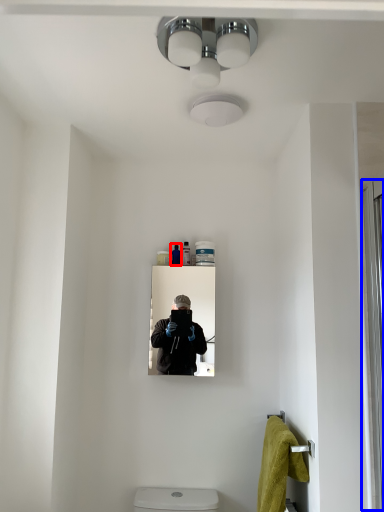
Question: Which object is further to the camera taking this photo, toiletry (highlighted by a red box) or screen door (highlighted by a blue box)?

Choices:
 (A) toiletry
 (B) screen door

Answer: (A)